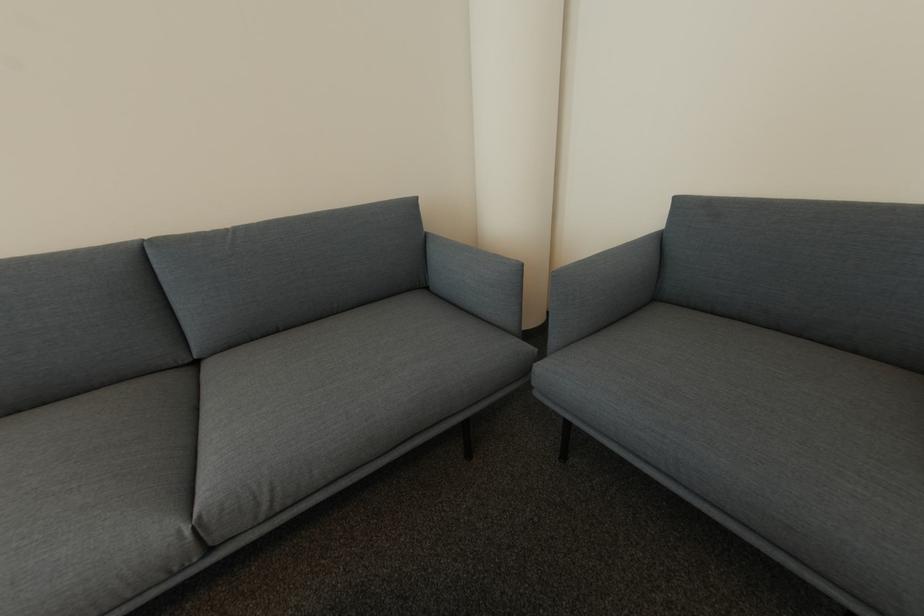
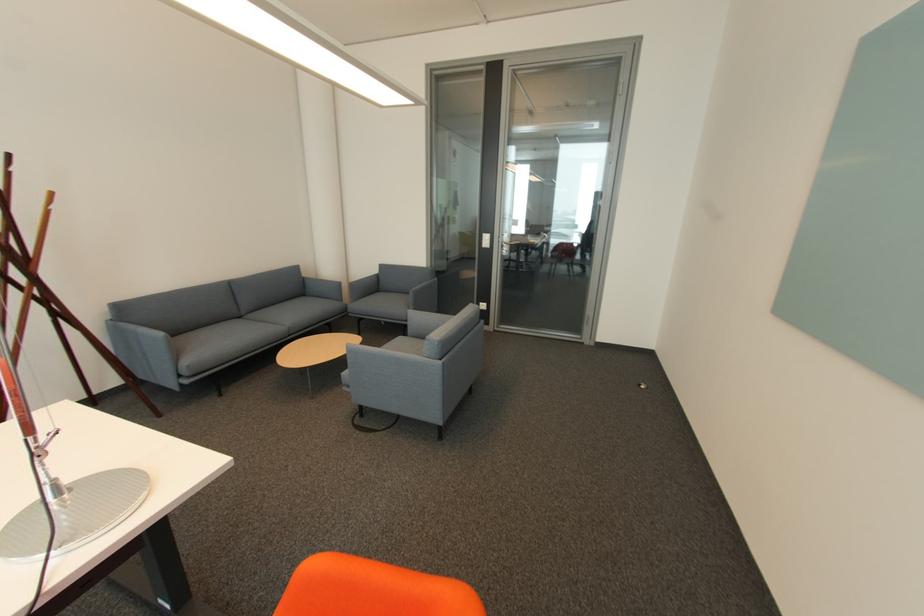
Locate, in the second image, the point that corresponds to [432,236] in the first image.

(310, 278)